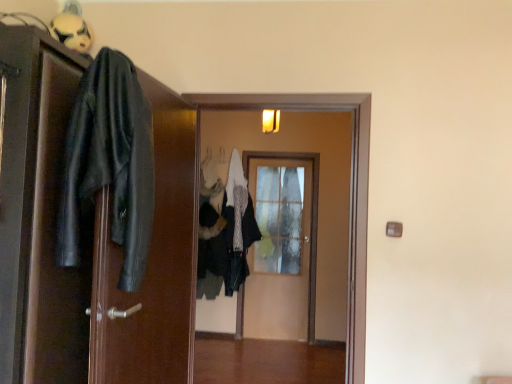
Question: From a real-world perspective, is white matte mask at upper left positioned under black leather jacket at left, which is the third door from back to front, based on gravity?

Choices:
 (A) no
 (B) yes

Answer: (A)

Question: Is black leather jacket at left, the 1th door positioned from the left, at the back of white matte mask at upper left?

Choices:
 (A) yes
 (B) no

Answer: (B)

Question: Considering the relative sizes of white matte mask at upper left and black leather jacket at left, the 3th door positioned from the right, in the image provided, is white matte mask at upper left taller than black leather jacket at left, the 3th door positioned from the right,?

Choices:
 (A) yes
 (B) no

Answer: (B)

Question: From the image's perspective, would you say white matte mask at upper left is positioned over black leather jacket at left, the 1th door positioned from the left?

Choices:
 (A) no
 (B) yes

Answer: (B)

Question: Is white matte mask at upper left at the right side of black leather jacket at left, the 3th door positioned from the right?

Choices:
 (A) no
 (B) yes

Answer: (A)

Question: Based on their sizes in the image, would you say black leather jacket at left, positioned as the 2th clothing in right-to-left order, is bigger or smaller than white matte mask at upper left?

Choices:
 (A) big
 (B) small

Answer: (A)

Question: From the image's perspective, is black leather jacket at left, which ranks as the first clothing in left-to-right order, positioned above or below white matte mask at upper left?

Choices:
 (A) above
 (B) below

Answer: (B)

Question: Is black leather jacket at left, positioned as the 2th clothing in right-to-left order, wider or thinner than white matte mask at upper left?

Choices:
 (A) thin
 (B) wide

Answer: (B)

Question: Does point (95, 182) appear closer or farther from the camera than point (84, 36)?

Choices:
 (A) closer
 (B) farther

Answer: (A)

Question: In the image, is wooden door at center, placed as the 2th door when sorted from front to back, positioned in front of or behind black leather jacket at left, the 1th door positioned from the left?

Choices:
 (A) front
 (B) behind

Answer: (B)

Question: Looking at the image, does wooden door at center, the 2th door in the back-to-front sequence, seem bigger or smaller compared to black leather jacket at left, the 1th door positioned from the left?

Choices:
 (A) small
 (B) big

Answer: (A)

Question: Considering the positions of wooden door at center, placed as the 2th door when sorted from front to back, and black leather jacket at left, the 1th door positioned from the left, in the image, is wooden door at center, placed as the 2th door when sorted from front to back, wider or thinner than black leather jacket at left, the 1th door positioned from the left,?

Choices:
 (A) thin
 (B) wide

Answer: (A)

Question: In terms of height, does wooden door at center, the 2th door in the back-to-front sequence, look taller or shorter compared to black leather jacket at left, the 1th door positioned from the left?

Choices:
 (A) tall
 (B) short

Answer: (A)

Question: Choose the correct answer: Is white textured coat at center, which is the second clothing in left-to-right order, inside black leather jacket at left, the first door from the front, or outside it?

Choices:
 (A) inside
 (B) outside

Answer: (B)

Question: From a real-world perspective, is white textured coat at center, the 1th clothing when ordered from back to front, above or below black leather jacket at left, the 1th door positioned from the left?

Choices:
 (A) above
 (B) below

Answer: (B)